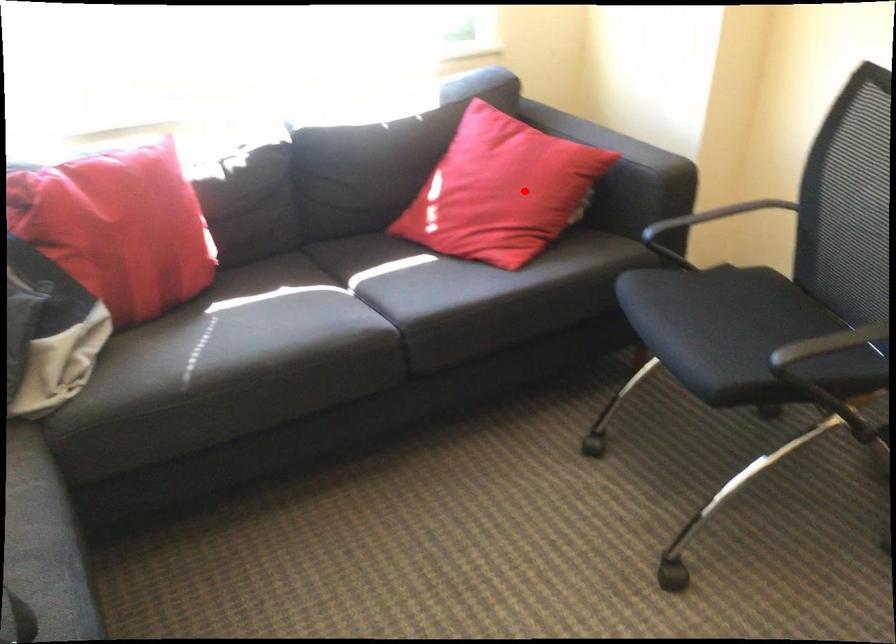
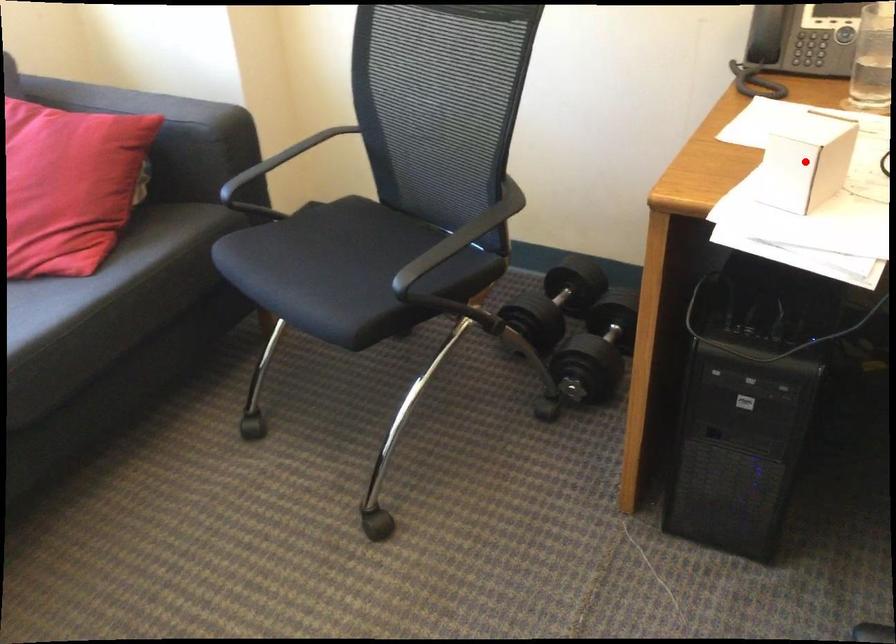
I am providing you with two images of the same scene from different viewpoints. A red point is marked on the first image and another point is marked on the second image. Is the marked point in image1 the same physical position as the marked point in image2?

No